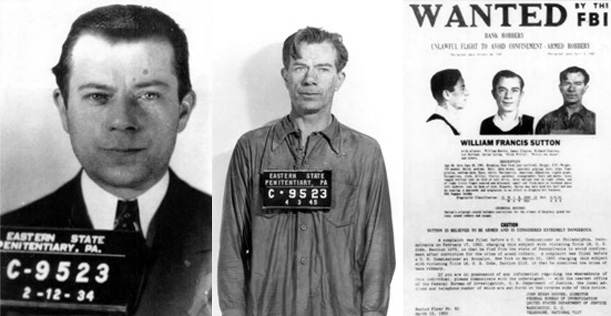
Identify the location of nose of leftmost portrait. (122, 118).